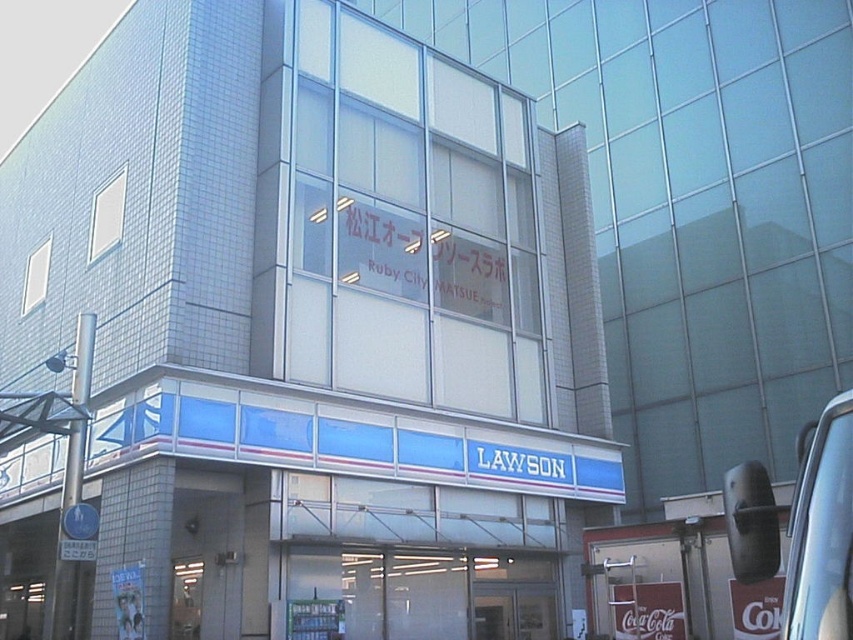
Question: From the image, what is the correct spatial relationship of metallic gray mirror at right in relation to transparent glass door at lower center?

Choices:
 (A) below
 (B) above

Answer: (B)

Question: Can you confirm if metallic gray mirror at right is wider than transparent glass door at lower center?

Choices:
 (A) no
 (B) yes

Answer: (B)

Question: Which of the following is the farthest from the observer?

Choices:
 (A) (x=815, y=497)
 (B) (x=209, y=566)

Answer: (B)

Question: Does metallic gray mirror at right have a lesser width compared to transparent glass door at lower center?

Choices:
 (A) yes
 (B) no

Answer: (B)